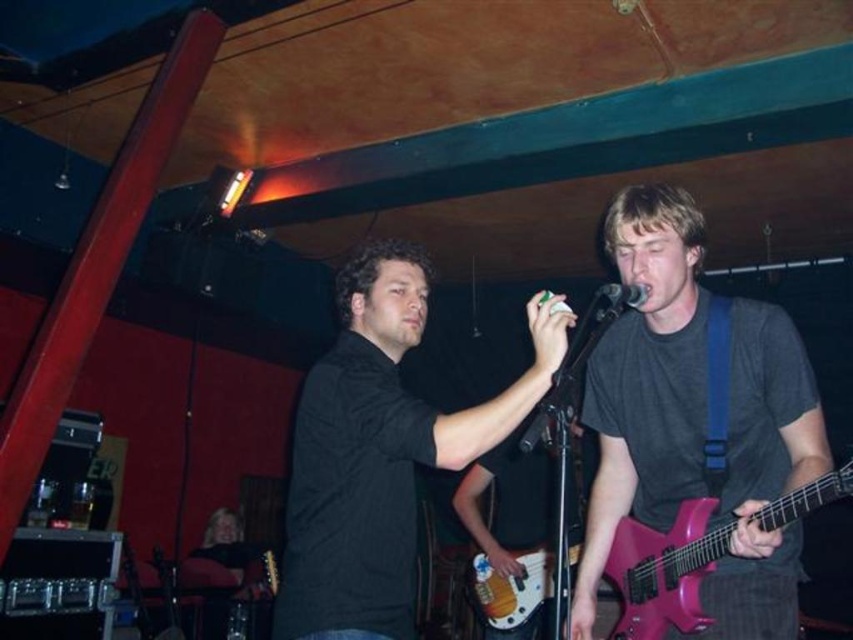
Does matte pink electric guitar at right have a larger size compared to matte black guitar at center?

Incorrect, matte pink electric guitar at right is not larger than matte black guitar at center.

Between matte pink electric guitar at right and matte black guitar at center, which one appears on the left side from the viewer's perspective?

matte black guitar at center is more to the left.

Is point (682, 534) farther from camera compared to point (544, 468)?

No, (682, 534) is closer to viewer.

Identify the location of matte pink electric guitar at right. (665, 570).

I want to click on matte pink electric guitar at right, so click(665, 570).

Between matte pink electric guitar at right and black metallic microphone at upper center, which one has less height?

With less height is black metallic microphone at upper center.

Image resolution: width=853 pixels, height=640 pixels. Find the location of `matte pink electric guitar at right`. matte pink electric guitar at right is located at coordinates pos(665,570).

Between point (381, 371) and point (575, 481), which one is positioned behind?

Positioned behind is point (575, 481).

Who is positioned more to the right, black matte shirt at center or matte black guitar at center?

matte black guitar at center is more to the right.

Where is `black matte shirt at center`? Image resolution: width=853 pixels, height=640 pixels. black matte shirt at center is located at coordinates (379, 451).